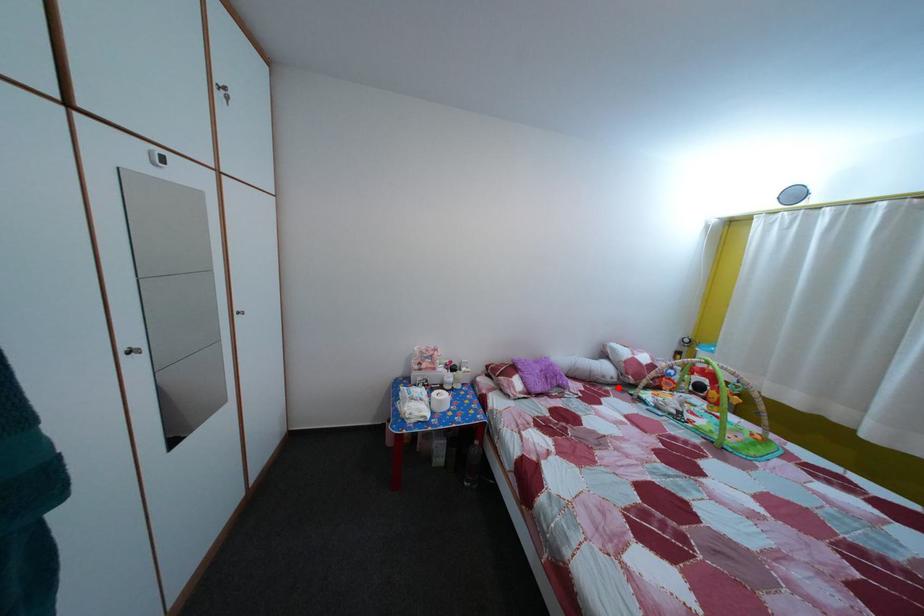
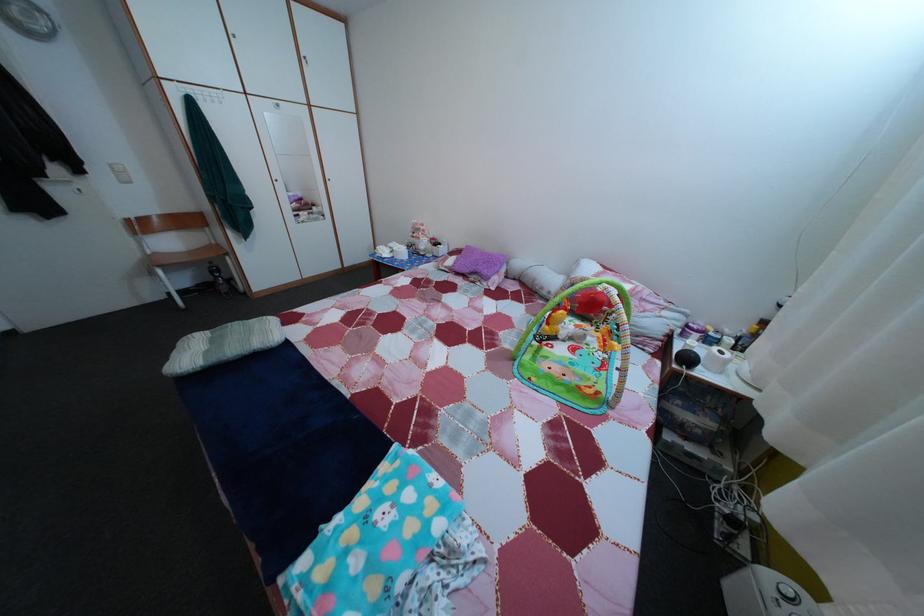
Question: I am providing you with two images of the same scene from different viewpoints. Given a red point in image1, look at the same physical point in image2. Is it:

Choices:
 (A) Closer to the viewpoint
 (B) Farther from the viewpoint

Answer: (A)